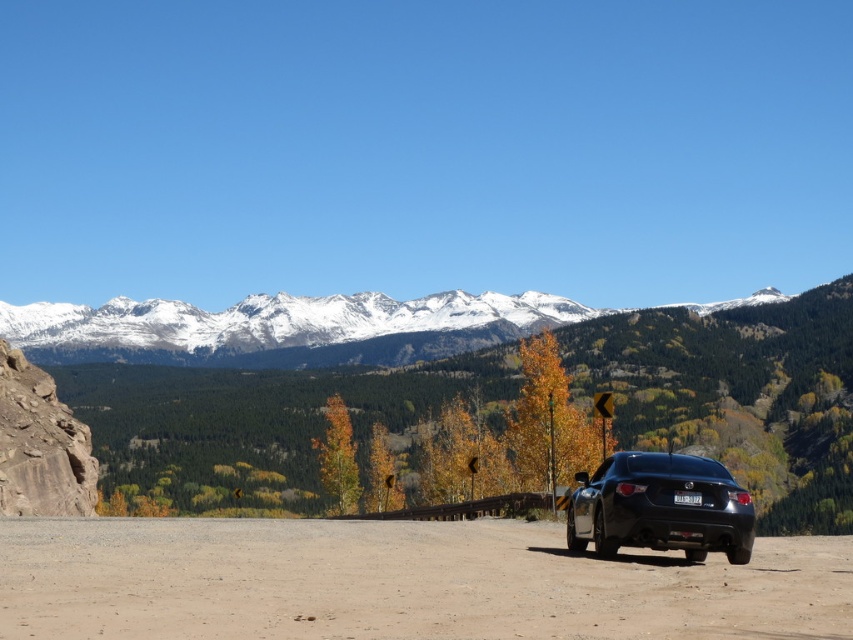
Does snowy granite mountain range at upper center have a lesser height compared to black matte car at right?

No.

Locate an element on the screen. The width and height of the screenshot is (853, 640). snowy granite mountain range at upper center is located at coordinates (283, 328).

Which is more to the right, dirt/gravel road at lower center or snowy granite mountain range at upper center?

dirt/gravel road at lower center is more to the right.

Is dirt/gravel road at lower center to the right of snowy granite mountain range at upper center from the viewer's perspective?

Indeed, dirt/gravel road at lower center is positioned on the right side of snowy granite mountain range at upper center.

This screenshot has width=853, height=640. In order to click on dirt/gravel road at lower center in this screenshot , I will do `click(399, 582)`.

Where is `dirt/gravel road at lower center`? dirt/gravel road at lower center is located at coordinates (399, 582).

Which of these two, dirt/gravel road at lower center or black matte car at right, stands taller?

dirt/gravel road at lower center is taller.

Measure the distance between dirt/gravel road at lower center and camera.

A distance of 100.88 meters exists between dirt/gravel road at lower center and camera.

You are a GUI agent. You are given a task and a screenshot of the screen. Output one action in this format:
    pyautogui.click(x=<x>, y=<y>)
    Task: Click on the dirt/gravel road at lower center
    The height and width of the screenshot is (640, 853).
    Given the screenshot: What is the action you would take?
    pyautogui.click(x=399, y=582)